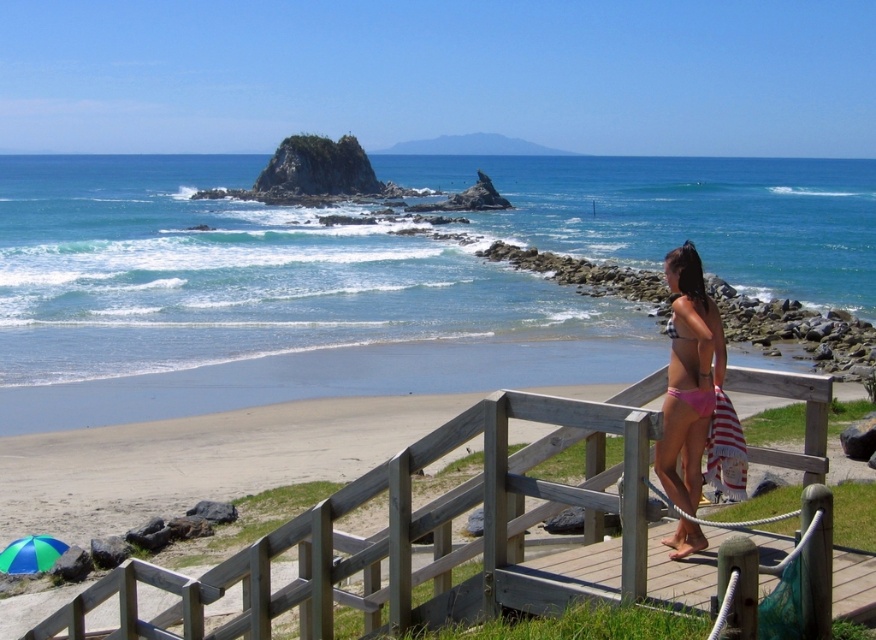
Between wooden at center and pink fabric bikini at right, which one is positioned higher?

Positioned higher is pink fabric bikini at right.

Does wooden at center have a lesser width compared to pink fabric bikini at right?

No, wooden at center is not thinner than pink fabric bikini at right.

This screenshot has height=640, width=876. Describe the element at coordinates (562, 579) in the screenshot. I see `wooden at center` at that location.

You are a GUI agent. You are given a task and a screenshot of the screen. Output one action in this format:
    pyautogui.click(x=<x>, y=<y>)
    Task: Click on the wooden at center
    The width and height of the screenshot is (876, 640).
    Given the screenshot: What is the action you would take?
    pyautogui.click(x=562, y=579)

Does pink bikini at center have a greater width compared to green fabric umbrella at lower left?

No.

Between pink bikini at center and green fabric umbrella at lower left, which one is positioned higher?

pink bikini at center

The height and width of the screenshot is (640, 876). Find the location of `pink bikini at center`. pink bikini at center is located at coordinates (689, 378).

Between wooden at center and green fabric umbrella at lower left, which one has more height?

wooden at center is taller.

Describe the element at coordinates (562, 579) in the screenshot. I see `wooden at center` at that location.

Find the location of a particular element. The width and height of the screenshot is (876, 640). wooden at center is located at coordinates (562, 579).